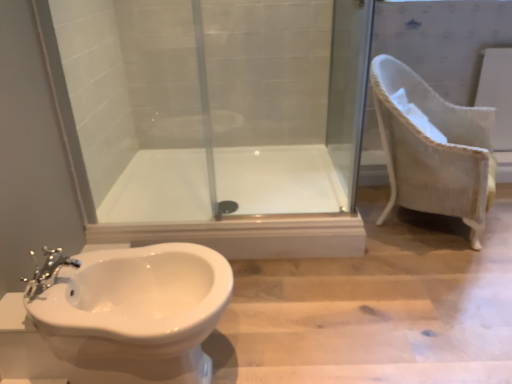
Question: Considering the relative sizes of white glossy toilet at lower left and transparent glass screen door at center in the image provided, is white glossy toilet at lower left shorter than transparent glass screen door at center?

Choices:
 (A) no
 (B) yes

Answer: (B)

Question: Does white glossy toilet at lower left have a smaller size compared to transparent glass screen door at center?

Choices:
 (A) yes
 (B) no

Answer: (B)

Question: Is white glossy toilet at lower left not close to transparent glass screen door at center?

Choices:
 (A) yes
 (B) no

Answer: (A)

Question: Is the surface of white glossy toilet at lower left in direct contact with transparent glass screen door at center?

Choices:
 (A) yes
 (B) no

Answer: (B)

Question: Is white glossy toilet at lower left positioned behind transparent glass screen door at center?

Choices:
 (A) yes
 (B) no

Answer: (B)

Question: Is white glossy toilet at lower left to the left of transparent glass screen door at center from the viewer's perspective?

Choices:
 (A) yes
 (B) no

Answer: (A)

Question: Does white woven armchair at right appear on the left side of white glossy bath at center?

Choices:
 (A) yes
 (B) no

Answer: (B)

Question: From a real-world perspective, is white woven armchair at right positioned over white glossy bath at center based on gravity?

Choices:
 (A) yes
 (B) no

Answer: (A)

Question: Does white woven armchair at right come behind white glossy bath at center?

Choices:
 (A) no
 (B) yes

Answer: (A)

Question: Is there a large distance between white woven armchair at right and white glossy bath at center?

Choices:
 (A) no
 (B) yes

Answer: (A)

Question: Can you confirm if white woven armchair at right is shorter than white glossy bath at center?

Choices:
 (A) yes
 (B) no

Answer: (B)

Question: Can you see white woven armchair at right touching white glossy bath at center?

Choices:
 (A) no
 (B) yes

Answer: (A)

Question: Is the depth of white glossy bath at center less than that of white glossy toilet at lower left?

Choices:
 (A) no
 (B) yes

Answer: (A)